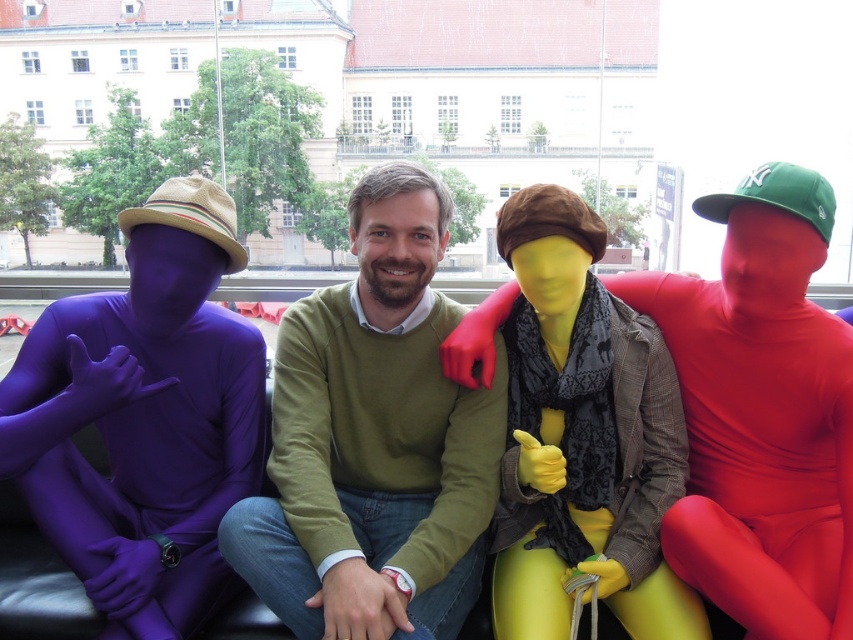
Question: Does matte yellow skin at center appear on the right side of yellow matte/glossy suit at center?

Choices:
 (A) no
 (B) yes

Answer: (B)

Question: Which of the following is the farthest from the observer?

Choices:
 (A) (631, 625)
 (B) (647, 308)
 (C) (248, 353)

Answer: (B)

Question: Is purple matte/skinny suit at left thinner than yellow matte/glossy suit at center?

Choices:
 (A) yes
 (B) no

Answer: (B)

Question: Is purple matte/skinny suit at left thinner than yellow matte/glossy suit at center?

Choices:
 (A) yes
 (B) no

Answer: (B)

Question: Which point is closer to the camera taking this photo?

Choices:
 (A) (277, 442)
 (B) (16, 435)

Answer: (B)

Question: Among these points, which one is nearest to the camera?

Choices:
 (A) (120, 436)
 (B) (628, 609)
 (C) (485, 442)

Answer: (B)